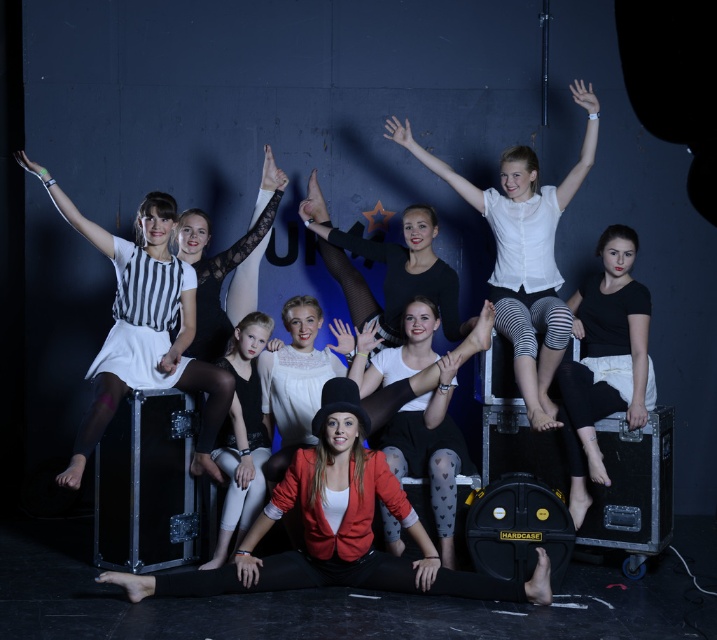
Question: Is black matte shirt at center above white lace dress at center?

Choices:
 (A) yes
 (B) no

Answer: (A)

Question: Which of the following is the farthest from the observer?

Choices:
 (A) striped fabric dress at center
 (B) black matte shirt at center
 (C) white matte tights at center

Answer: (B)

Question: Is matte white blouse at center to the right of white lace dress at center from the viewer's perspective?

Choices:
 (A) yes
 (B) no

Answer: (B)

Question: Which point is farther from the camera taking this photo?

Choices:
 (A) (432, 474)
 (B) (313, 324)
 (C) (597, 403)
 (D) (337, 451)

Answer: (B)

Question: Is black matte shirt at center thinner than matte black dress at center?

Choices:
 (A) no
 (B) yes

Answer: (A)

Question: Estimate the real-world distances between objects in this image. Which object is farther from the white matte tights at center?

Choices:
 (A) matte white blouse at center
 (B) white matte dress at upper left
 (C) matte black dress at center

Answer: (B)